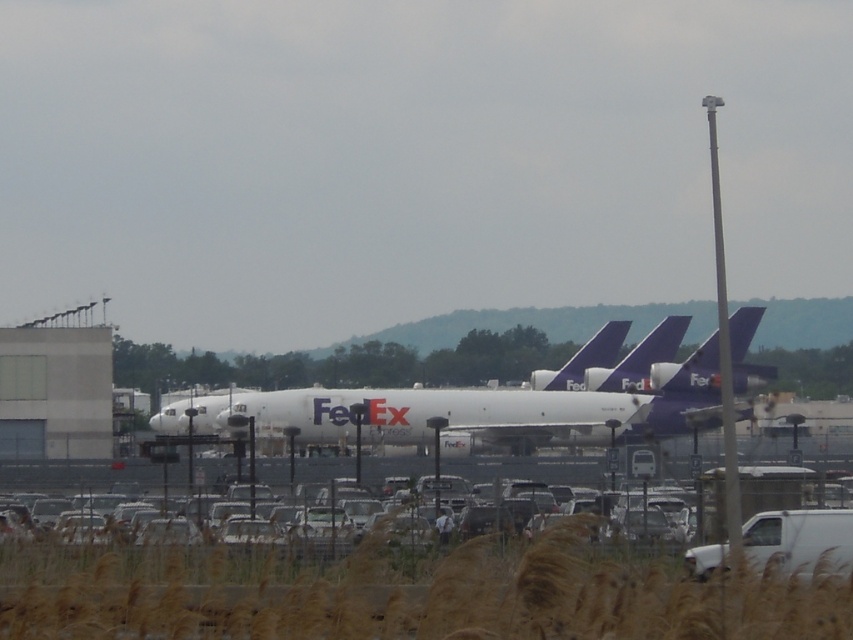
Does white matte fedex plane at center appear on the left side of white matte car at lower center?

No, white matte fedex plane at center is not to the left of white matte car at lower center.

Find the location of `white matte fedex plane at center`. white matte fedex plane at center is located at coordinates (473, 410).

Where is `white matte fedex plane at center`? The width and height of the screenshot is (853, 640). white matte fedex plane at center is located at coordinates (473, 410).

From the picture: Can you confirm if white matte van at lower right is smaller than white matte car at lower center?

Yes, white matte van at lower right is smaller than white matte car at lower center.

Can you confirm if white matte van at lower right is taller than white matte car at lower center?

No, white matte van at lower right is not taller than white matte car at lower center.

You are a GUI agent. You are given a task and a screenshot of the screen. Output one action in this format:
    pyautogui.click(x=<x>, y=<y>)
    Task: Click on the white matte van at lower right
    The width and height of the screenshot is (853, 640).
    Given the screenshot: What is the action you would take?
    pyautogui.click(x=799, y=540)

Who is more forward, (165, 408) or (778, 531)?

Positioned in front is point (778, 531).

Is white matte fedex plane at center closer to the viewer compared to white matte van at lower right?

No, white matte fedex plane at center is behind white matte van at lower right.

Does point (717, 381) come in front of point (830, 570)?

No, it is behind (830, 570).

This screenshot has width=853, height=640. Identify the location of white matte fedex plane at center. coord(473,410).